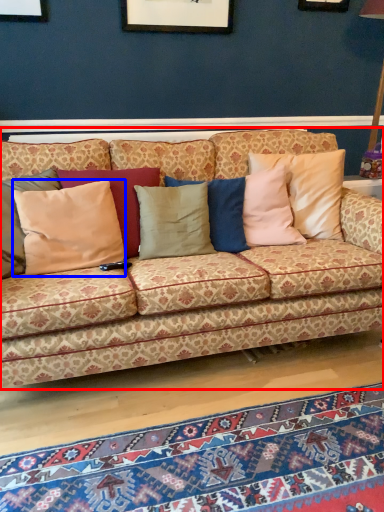
Question: Which object appears farthest to the camera in this image, studio couch (highlighted by a red box) or pillow (highlighted by a blue box)?

Choices:
 (A) studio couch
 (B) pillow

Answer: (B)